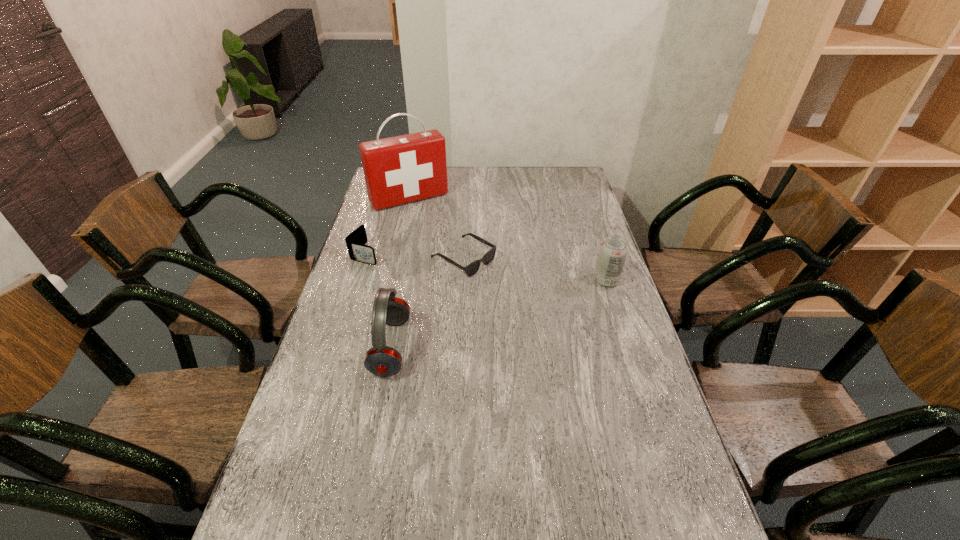
The width and height of the screenshot is (960, 540). I want to click on the nearest object, so click(x=381, y=360).

At what (x,y) coordinates should I click in order to perform the action: click on earphone. Please return your answer as a coordinate pair (x, y). Looking at the image, I should click on (381, 360).

This screenshot has height=540, width=960. Find the location of `soda can`. soda can is located at coordinates (613, 251).

You are a GUI agent. You are given a task and a screenshot of the screen. Output one action in this format:
    pyautogui.click(x=<x>, y=<y>)
    Task: Click on the third shortest object
    This screenshot has width=960, height=540.
    Given the screenshot: What is the action you would take?
    pyautogui.click(x=613, y=251)

Identify the location of the shortest object. (471, 269).

Find the location of a particular element. Image resolution: width=960 pixels, height=540 pixels. the fourth tallest object is located at coordinates (358, 251).

At what (x,y) coordinates should I click in order to perform the action: click on the first-aid kit. Please return your answer as a coordinate pair (x, y). The image size is (960, 540). Looking at the image, I should click on (398, 170).

At what (x,y) coordinates should I click in order to perform the action: click on the tallest object. Please return your answer as a coordinate pair (x, y). This screenshot has width=960, height=540. Looking at the image, I should click on (398, 170).

This screenshot has width=960, height=540. I want to click on free space located 0.080m on the ear cups of the nearest object, so click(x=347, y=347).

Locate an element on the screen. Image resolution: width=960 pixels, height=540 pixels. vacant space located on the ear cups of the nearest object is located at coordinates (336, 347).